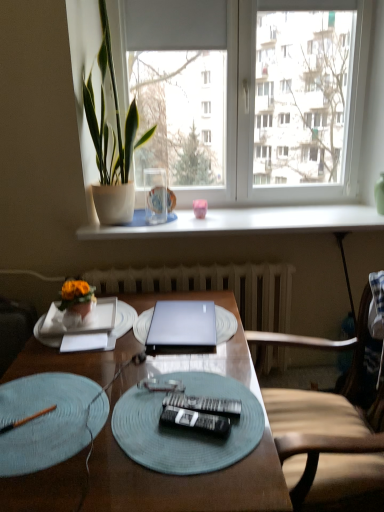
At what (x,y) coordinates should I click in order to perform the action: click on vacant area that lies between black plastic remote control at center, which ranks as the second remote control in front-to-back order, and light blue textured placemat at lower left. Please return your answer as a coordinate pair (x, y). Looking at the image, I should click on (144, 415).